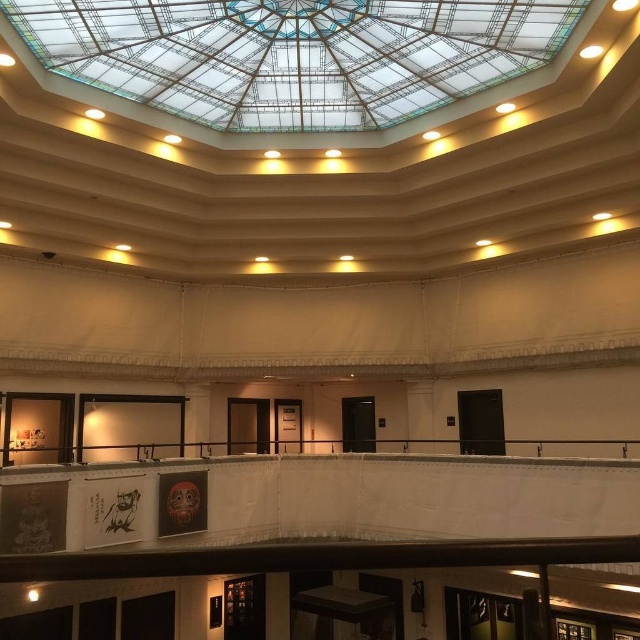
Question: Which point is closer to the camera?

Choices:
 (A) (93, 61)
 (B) (557, 456)

Answer: (A)

Question: Which object is farther from the camera taking this photo?

Choices:
 (A) transparent glass ceiling at upper center
 (B) black metal rail at center

Answer: (B)

Question: Among these points, which one is farthest from the camera?

Choices:
 (A) (280, 54)
 (B) (612, 456)

Answer: (B)

Question: Considering the relative positions of transparent glass ceiling at upper center and black metal rail at center in the image provided, where is transparent glass ceiling at upper center located with respect to black metal rail at center?

Choices:
 (A) below
 (B) above

Answer: (B)

Question: Does transparent glass ceiling at upper center come behind black metal rail at center?

Choices:
 (A) yes
 (B) no

Answer: (B)

Question: Does transparent glass ceiling at upper center have a greater width compared to black metal rail at center?

Choices:
 (A) no
 (B) yes

Answer: (A)